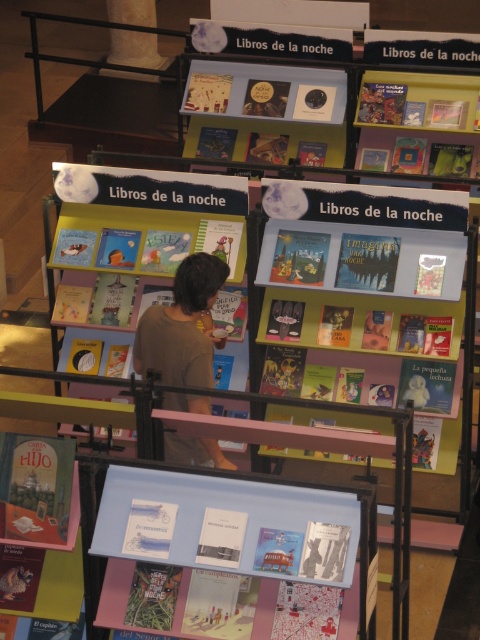
This screenshot has height=640, width=480. What do you see at coordinates (35, 486) in the screenshot?
I see `hardcover book at lower left` at bounding box center [35, 486].

Does hardcover book at lower left have a greater height compared to white marble pillar at upper left?

No, hardcover book at lower left is not taller than white marble pillar at upper left.

Does point (24, 540) come closer to viewer compared to point (136, 13)?

Yes, point (24, 540) is closer to viewer.

Where is `hardcover book at lower left`? The width and height of the screenshot is (480, 640). hardcover book at lower left is located at coordinates (35, 486).

Which is more to the left, blue cardboard book display at center or matte yellow book at upper right?

blue cardboard book display at center is more to the left.

At what (x,y) coordinates should I click in order to perform the action: click on blue cardboard book display at center. Please return your answer as a coordinate pair (x, y). Looking at the image, I should click on (233, 525).

Does brown matte shirt at center have a smaller size compared to white marble pillar at upper left?

Indeed, brown matte shirt at center has a smaller size compared to white marble pillar at upper left.

Can you confirm if brown matte shirt at center is wider than white marble pillar at upper left?

No, brown matte shirt at center is not wider than white marble pillar at upper left.

Find the location of a particular element. The image size is (480, 640). brown matte shirt at center is located at coordinates (181, 324).

Find the location of a particular element. brown matte shirt at center is located at coordinates (181, 324).